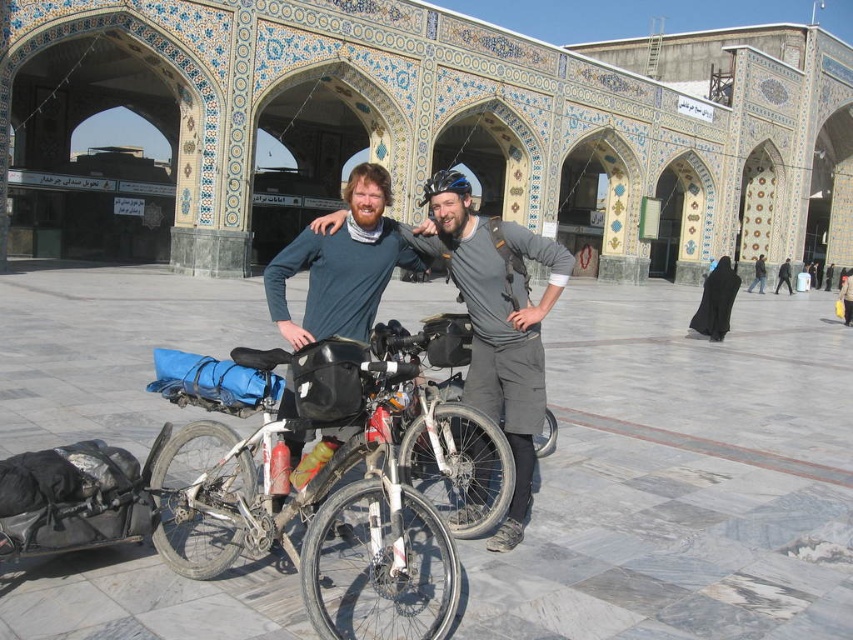
You are a photographer trying to capture a clear shot of both the white matte bicycle at center and the matte gray shirt at center. Since you want both subjects in focus, you need to adjust your camera settings. Which object should you focus on to ensure both are sharp?

You should focus on the white matte bicycle at center because it is closer to the viewer than the matte gray shirt at center. By focusing on the closer object, the depth of field will extend further back, increasing the likelihood that both are in focus.

You are a photographer planning to take a portrait of the two cyclists. You want to position them so that the matte gray shirt at center is on the right side of the black fabric headscarf at center. Which cyclist should move to the right to achieve this arrangement?

The cyclist wearing the matte gray shirt at center should move to the right so that it appears to the right of the black fabric headscarf at center.

You are a photographer planning to take a photo of the white matte bicycle at center and the matte gray shirt at center. To ensure both are in focus, you need to know their vertical positions. Which object is higher up in the image?

The white matte bicycle at center is positioned under the matte gray shirt at center, so the matte gray shirt at center is higher up in the image.